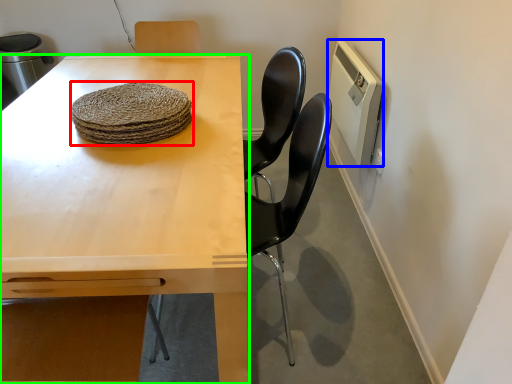
Question: Which is nearer to the food (highlighted by a red box)? appliance (highlighted by a blue box) or table (highlighted by a green box).

Choices:
 (A) appliance
 (B) table

Answer: (B)